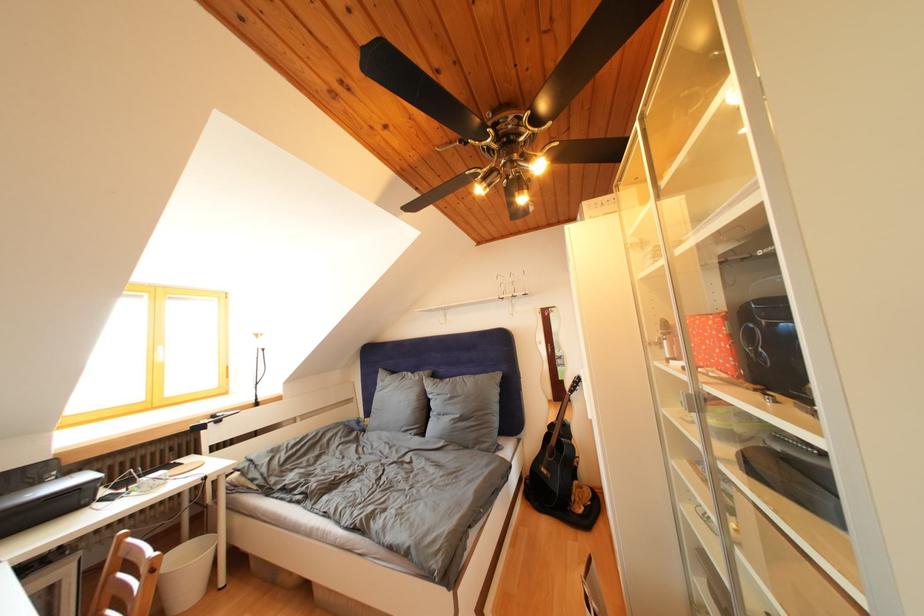
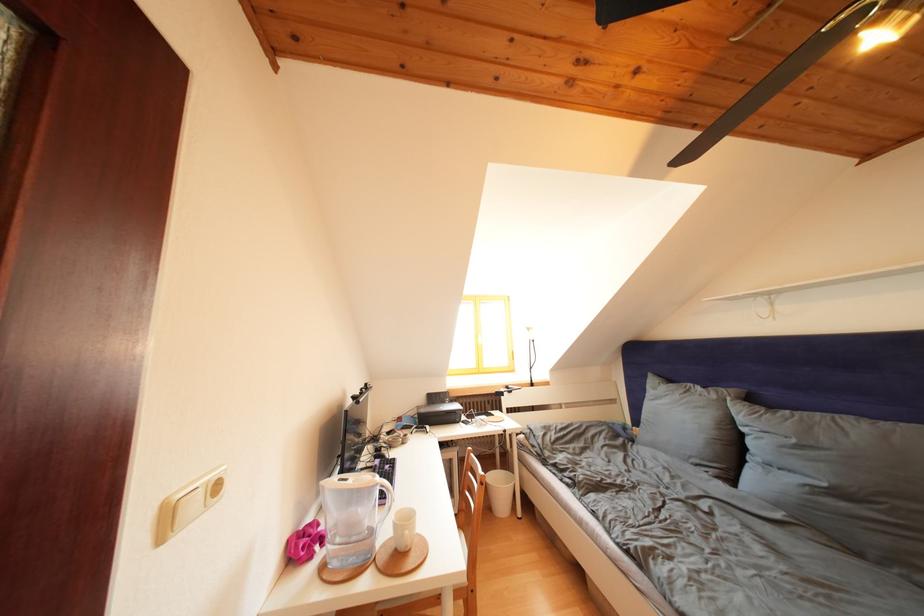
Question: I am providing you with two images of the same scene from different viewpoints. Which of the following objects are not visible in image2?

Choices:
 (A) white mug handle
 (B) light switch button
 (C) water pitcher handle
 (D) none of these

Answer: (D)